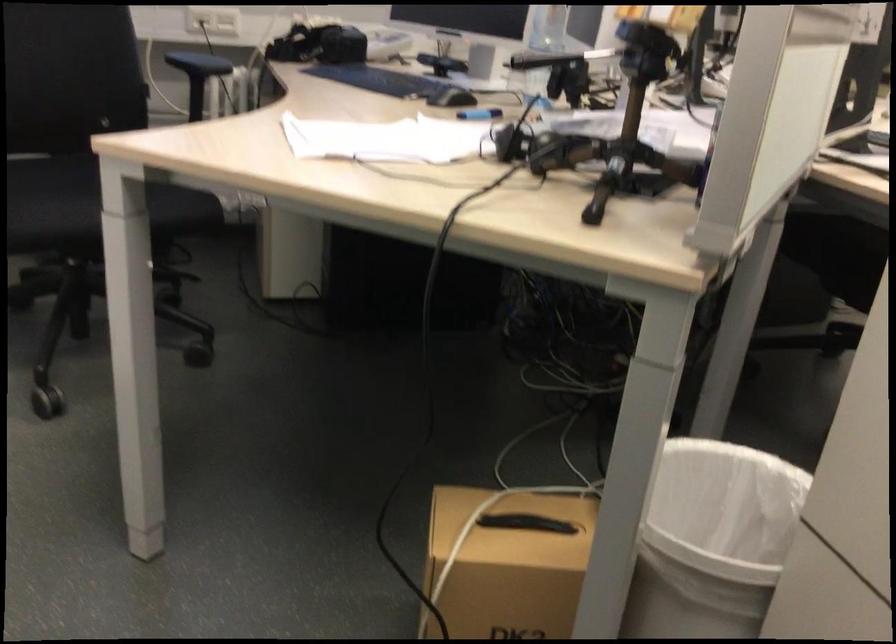
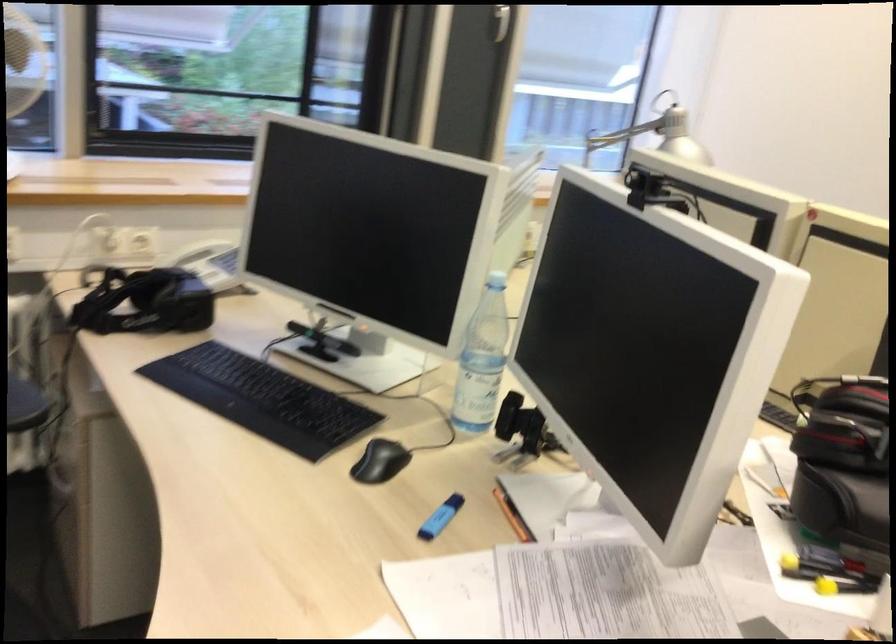
Question: The first image is from the beginning of the video and the second image is from the end. How did the camera likely rotate when shooting the video?

Choices:
 (A) Left
 (B) Right
 (C) Up
 (D) Down

Answer: (B)